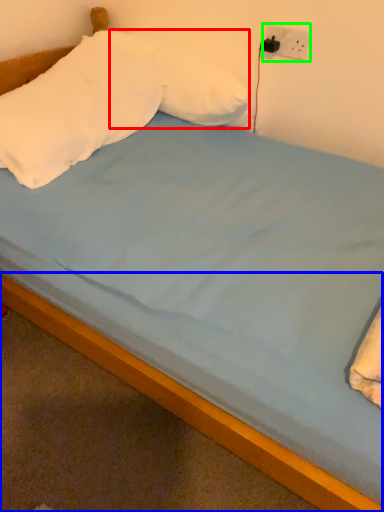
Question: Which is farther away from pillow (highlighted by a red box)? bed frame (highlighted by a blue box) or electric outlet (highlighted by a green box)?

Choices:
 (A) bed frame
 (B) electric outlet

Answer: (A)